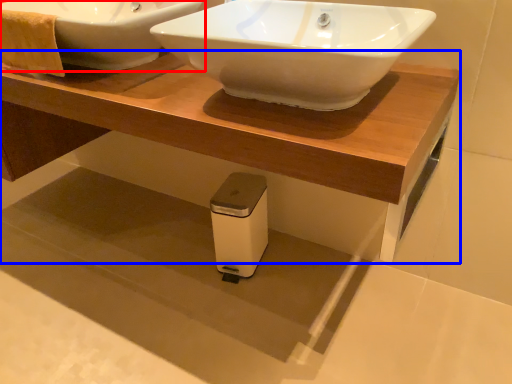
Question: Which object appears closest to the camera in this image, sink (highlighted by a red box) or table (highlighted by a blue box)?

Choices:
 (A) sink
 (B) table

Answer: (B)